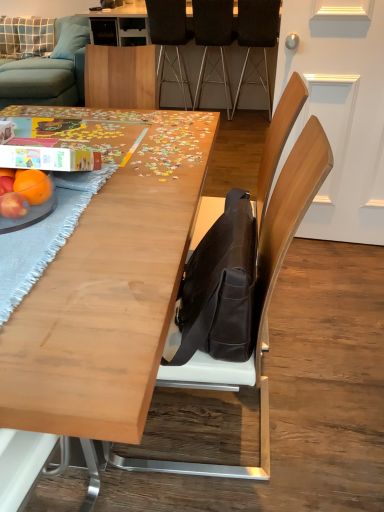
Locate an element on the screen. vacant space in brown leather chair at center, which is the 4th chair from back to front (from a real-world perspective) is located at coordinates (234, 423).